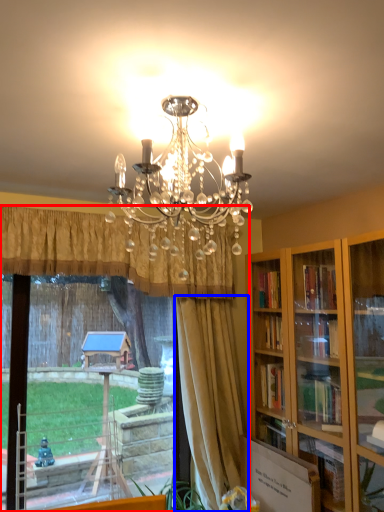
Question: Which object appears farthest to the camera in this image, window (highlighted by a red box) or curtain (highlighted by a blue box)?

Choices:
 (A) window
 (B) curtain

Answer: (B)